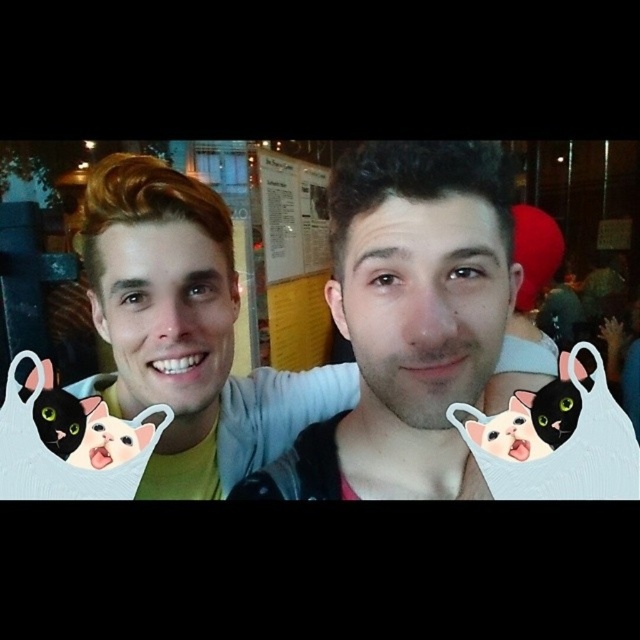
You are taking a photo of two people standing in front of you. You notice the matte white shirt at center and the matte yellow shirt at left. Which shirt is closer to the camera?

The matte white shirt at center is closer to the camera because it is in front of the matte yellow shirt at left.

You are a photographer trying to capture the perfect selfie. You notice the point at coordinates (406, 321) in the image. What object is located at this point?

The point at coordinates (406, 321) marks the matte white shirt at center.

You are a photographer trying to adjust the lighting for a night selfie. You notice the matte white shirt at center and the smooth skin face at center. Which object should you focus on to ensure proper exposure, considering their positions relative to each other?

The matte white shirt at center is to the left of smooth skin face at center, so focusing on the smooth skin face at center would ensure proper exposure since it is positioned to the right where the lighting might be better due to the artificial lights from nearby buildings mentioned in the scene.